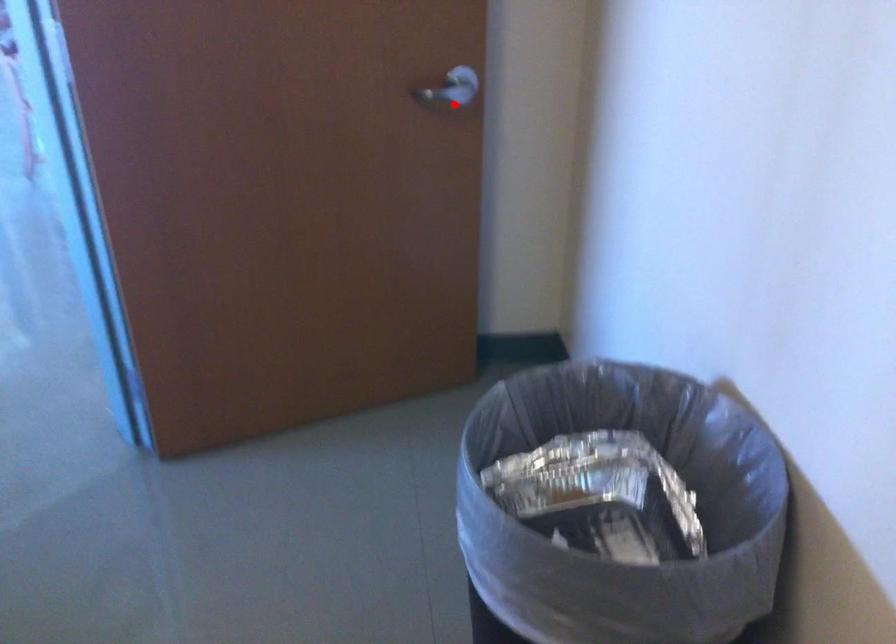
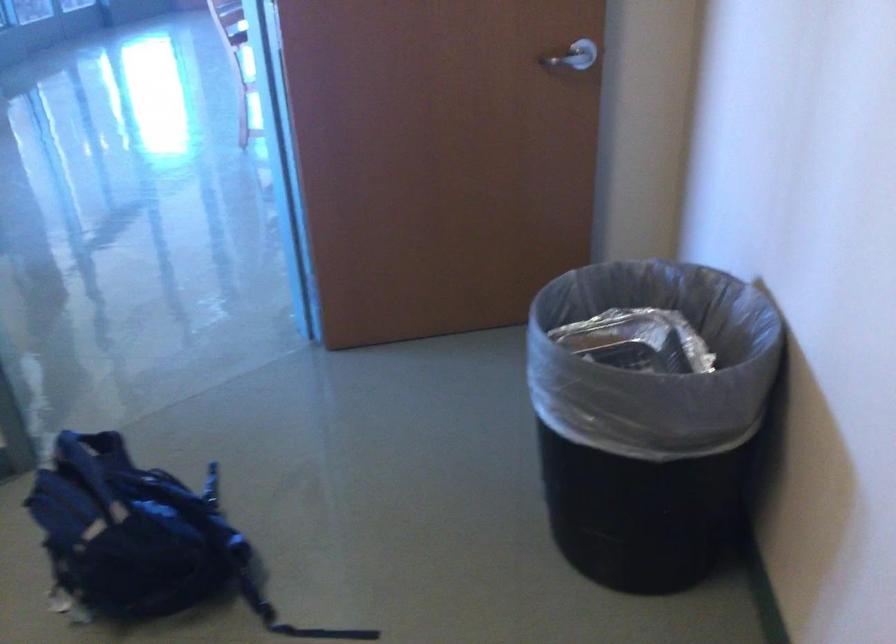
Question: I am providing you with two images of the same scene from different viewpoints. Image1 has a red point marked. In image2, the corresponding 3D location appears at what relative position? Reply with the corresponding letter.

Choices:
 (A) Closer
 (B) Farther

Answer: (B)